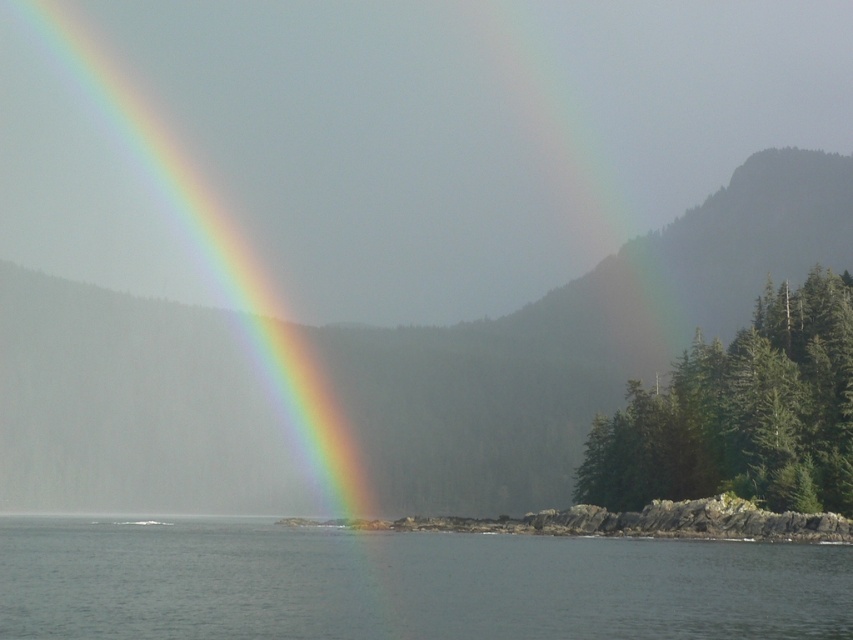
Question: Which of the following is the closest to the observer?

Choices:
 (A) (750, 332)
 (B) (393, 545)

Answer: (B)

Question: Is clear water at lower center smaller than green matte trees at right?

Choices:
 (A) yes
 (B) no

Answer: (B)

Question: Observing the image, what is the correct spatial positioning of rainbow at left in reference to green matte trees at right?

Choices:
 (A) right
 (B) left

Answer: (B)

Question: Which object is closer to the camera taking this photo?

Choices:
 (A) clear water at lower center
 (B) green matte trees at right
 (C) rainbow at left

Answer: (A)

Question: Is rainbow at left to the left of clear water at lower center from the viewer's perspective?

Choices:
 (A) no
 (B) yes

Answer: (B)

Question: Which object is the closest to the green matte trees at right?

Choices:
 (A) clear water at lower center
 (B) rainbow at left

Answer: (A)